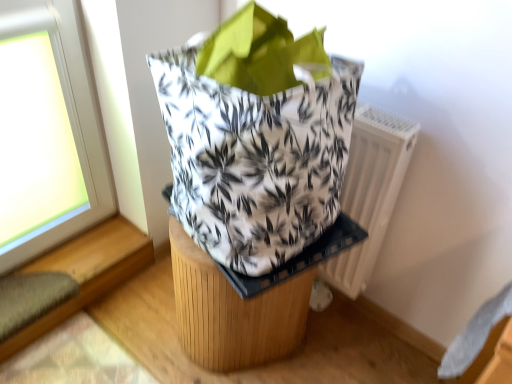
Question: Is white printed fabric grocery bag at center further to the viewer compared to white plastic radiator at right?

Choices:
 (A) yes
 (B) no

Answer: (B)

Question: Is white printed fabric grocery bag at center directly adjacent to white plastic radiator at right?

Choices:
 (A) no
 (B) yes

Answer: (A)

Question: From the image's perspective, is white printed fabric grocery bag at center beneath white plastic radiator at right?

Choices:
 (A) yes
 (B) no

Answer: (B)

Question: Could you tell me if white printed fabric grocery bag at center is turned towards white plastic radiator at right?

Choices:
 (A) yes
 (B) no

Answer: (B)

Question: From the image's perspective, is white printed fabric grocery bag at center over white plastic radiator at right?

Choices:
 (A) yes
 (B) no

Answer: (A)

Question: Is point (350, 274) closer or farther from the camera than point (150, 59)?

Choices:
 (A) closer
 (B) farther

Answer: (B)

Question: Which is correct: white plastic radiator at right is inside white printed fabric grocery bag at center, or outside of it?

Choices:
 (A) inside
 (B) outside

Answer: (B)

Question: From the image's perspective, is white plastic radiator at right above or below white printed fabric grocery bag at center?

Choices:
 (A) below
 (B) above

Answer: (A)

Question: From a real-world perspective, is white plastic radiator at right above or below white printed fabric grocery bag at center?

Choices:
 (A) below
 (B) above

Answer: (A)

Question: From a real-world perspective, relative to white printed fabric grocery bag at center, is wooden stool at center vertically above or below?

Choices:
 (A) below
 (B) above

Answer: (A)

Question: Considering their positions, is wooden stool at center located in front of or behind white printed fabric grocery bag at center?

Choices:
 (A) front
 (B) behind

Answer: (B)

Question: Is wooden stool at center inside the boundaries of white printed fabric grocery bag at center, or outside?

Choices:
 (A) inside
 (B) outside

Answer: (B)

Question: From their relative heights in the image, would you say wooden stool at center is taller or shorter than white printed fabric grocery bag at center?

Choices:
 (A) tall
 (B) short

Answer: (A)

Question: Looking at their shapes, would you say white plastic radiator at right is wider or thinner than wooden stool at center?

Choices:
 (A) wide
 (B) thin

Answer: (B)

Question: From the image's perspective, is white plastic radiator at right positioned above or below wooden stool at center?

Choices:
 (A) above
 (B) below

Answer: (A)